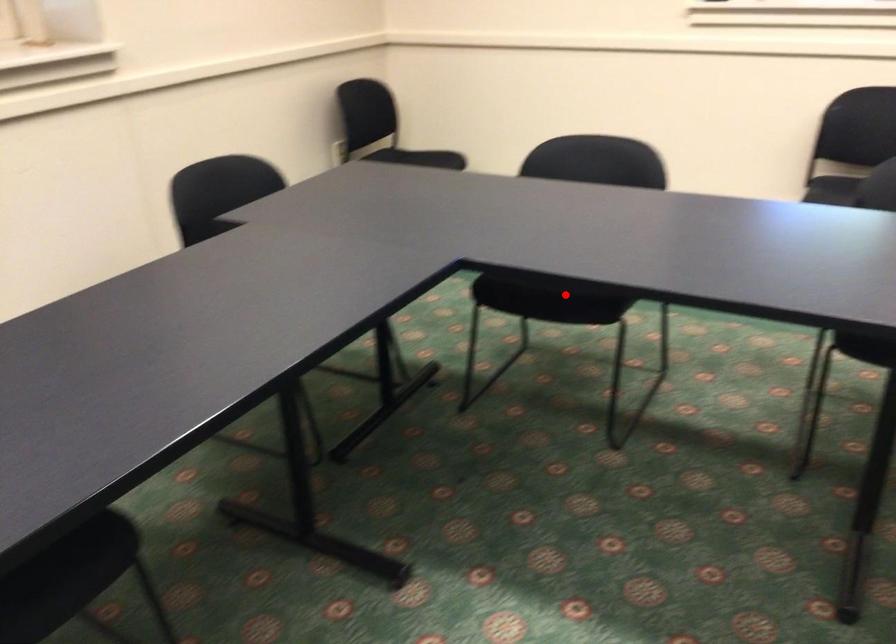
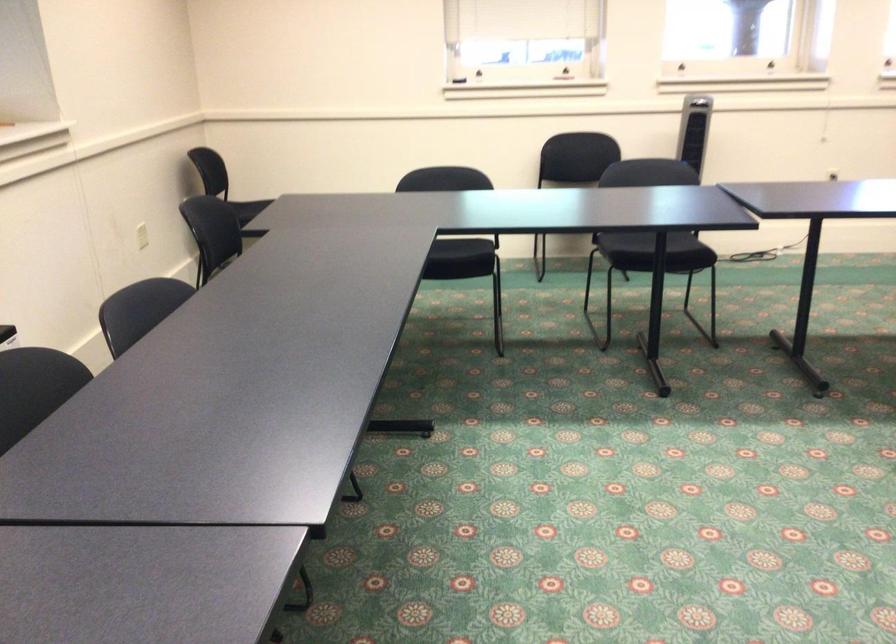
Locate, in the second image, the point that corresponds to the highlighted location in the first image.

(462, 257)